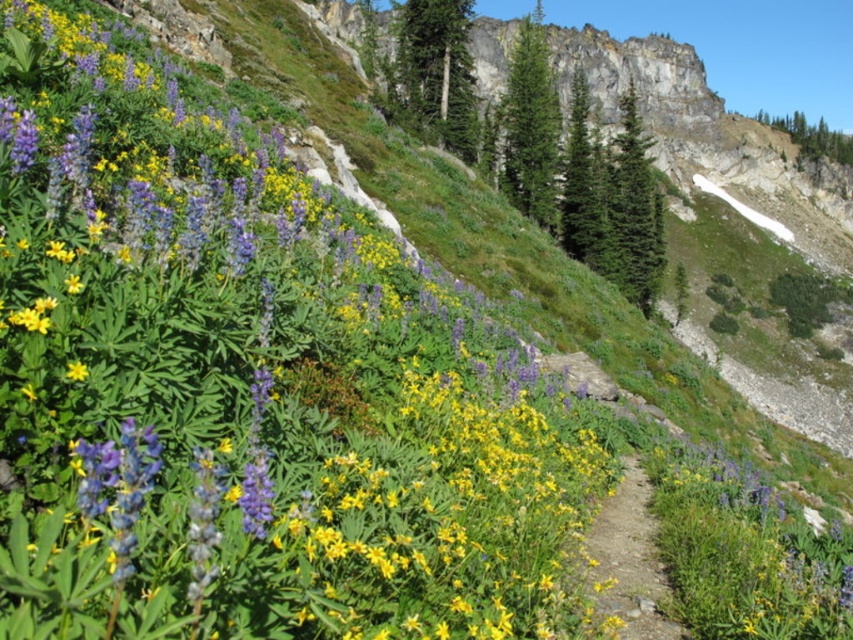
Question: Considering the relative positions of purple matte flower at upper left and dirt path at center in the image provided, where is purple matte flower at upper left located with respect to dirt path at center?

Choices:
 (A) left
 (B) right

Answer: (A)

Question: Among these objects, which one is farthest from the camera?

Choices:
 (A) purple matte flower at upper left
 (B) dirt path at center

Answer: (B)

Question: Does purple matte flower at upper left appear on the right side of dirt path at center?

Choices:
 (A) yes
 (B) no

Answer: (B)

Question: Which of the following is the closest to the observer?

Choices:
 (A) (62, 476)
 (B) (601, 518)

Answer: (A)

Question: Does purple matte flower at upper left appear over dirt path at center?

Choices:
 (A) yes
 (B) no

Answer: (A)